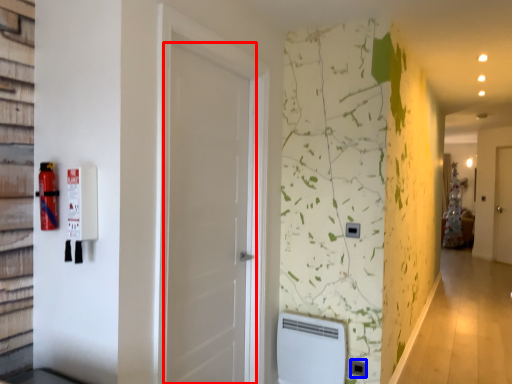
Question: Which of the following is the closest to the observer, door (highlighted by a red box) or electric outlet (highlighted by a blue box)?

Choices:
 (A) door
 (B) electric outlet

Answer: (A)